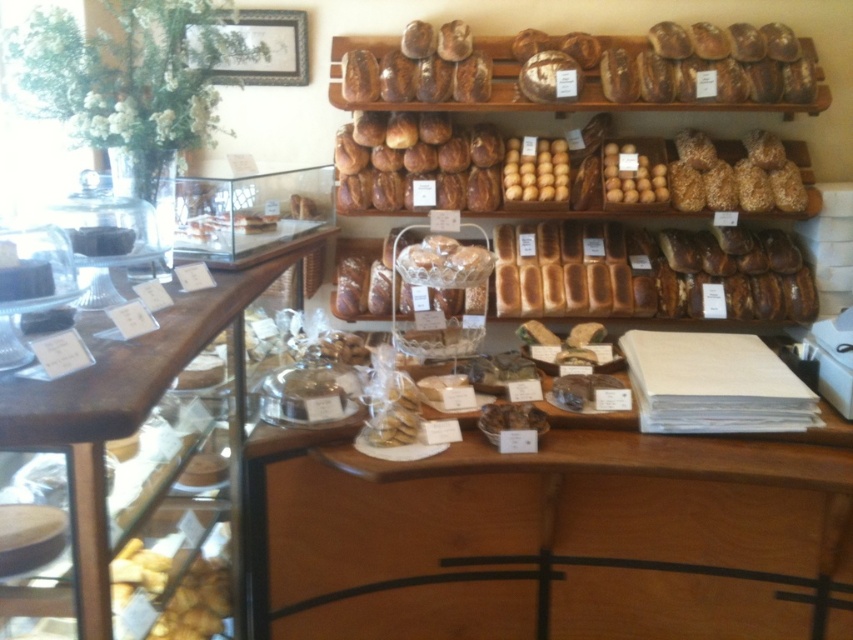
Question: Which of the following is the farthest from the observer?

Choices:
 (A) (440, 116)
 (B) (537, 144)
 (C) (637, 292)

Answer: (C)

Question: Is the position of baked golden-brown loaf at upper center more distant than that of golden brown crumbly pastry at lower left?

Choices:
 (A) yes
 (B) no

Answer: (A)

Question: Can you confirm if brown matte loaf of bread at center is positioned to the left of golden brown bread at center?

Choices:
 (A) no
 (B) yes

Answer: (B)

Question: Which object is closer to the camera taking this photo?

Choices:
 (A) golden brown bread at center
 (B) brown crumbly pastry at center
 (C) yellow matte muffins at center

Answer: (B)

Question: Is baked golden-brown loaf at upper center bigger than golden brown bread at center?

Choices:
 (A) yes
 (B) no

Answer: (A)

Question: Which object is positioned farthest from the baked golden-brown loaf at upper center?

Choices:
 (A) brown crumbly pastry at center
 (B) golden brown crusty loaf at upper center
 (C) golden brown crumbly pastry at lower left

Answer: (C)